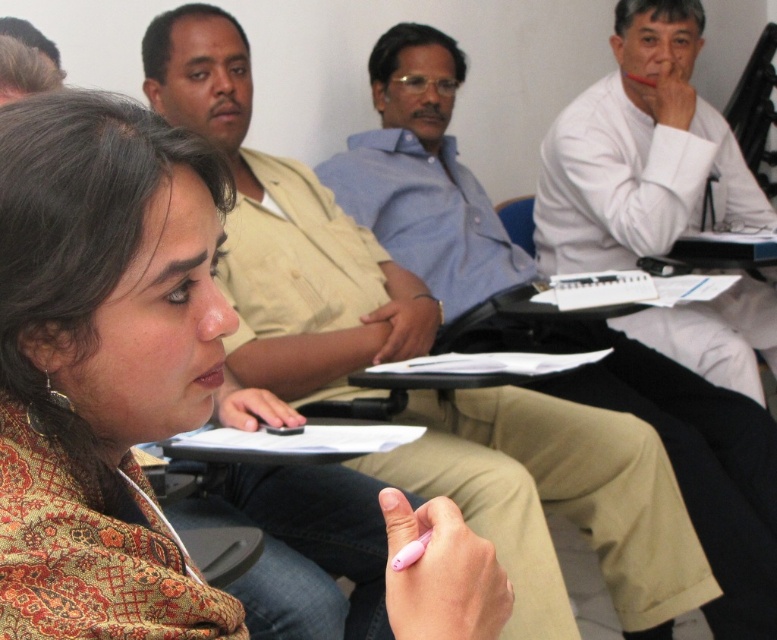
From the picture: You are organizing a small event and need to determine seating arrangements. You have a patterned fabric jacket at center and a blue fabric chair at center in the room. Which object takes up more space in the room?

The patterned fabric jacket at center is bigger than the blue fabric chair at center, so it takes up more space in the room.

You are standing in the classroom and want to reach the point marked at coordinates (82, 250). If your arm can extend 20 inches, can you reach that point without moving your feet?

The point marked at coordinates (82, 250) is 22.42 inches away from you, which is beyond the 20 inches your arm can extend. Therefore, you cannot reach it without moving your feet.

You are a photographer in the scene and want to capture both the patterned fabric jacket at center and the white smooth shirt at upper right in the same frame. Based on their positions, which one is positioned lower in the image?

The patterned fabric jacket at center is below the white smooth shirt at upper right, so the patterned fabric jacket at center is positioned lower in the image.